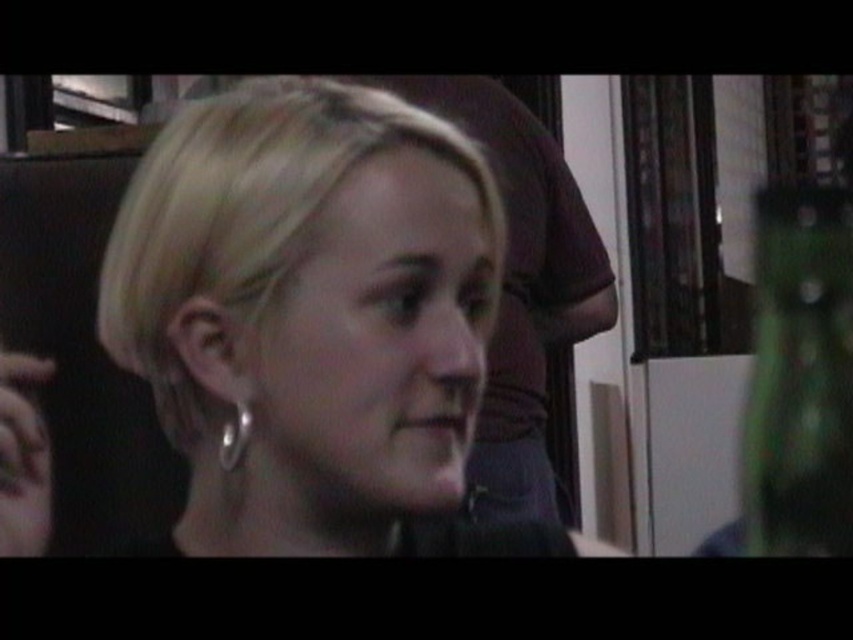
In the scene shown: Where is the smooth skin face at center positioned in the image?

The smooth skin face at center is positioned at coordinates point (521, 289).

You are taking a photo and want to focus on both the point at (544, 193) and the point at (836, 321) in the image. Which point should you adjust your focus to first to ensure both are in clear view?

You should focus on point (544, 193) first since it is closer to the camera. By focusing on the closer point, the farther point (836, 321) will also likely be in focus due to the depth of field, ensuring both are clear.

You are standing at the point marked as point (534,504) in the image. If you want to move closer to the viewer, which direction should you move?

Since point (534,504) is 3.85 feet away from the viewer, moving towards the viewer would require moving in the direction that reduces this distance. However, without additional spatial context about the room layout, the safest assumption is to move forward directly toward the viewer.